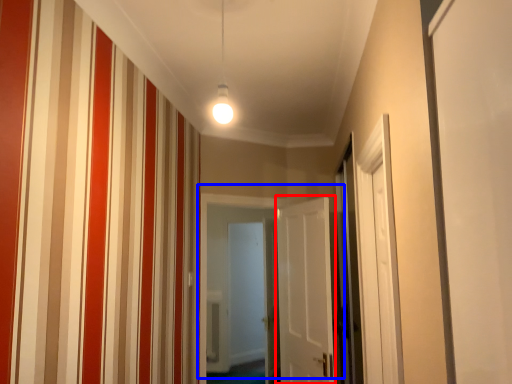
Question: Which object is closer to the camera taking this photo, door (highlighted by a red box) or door (highlighted by a blue box)?

Choices:
 (A) door
 (B) door

Answer: (A)